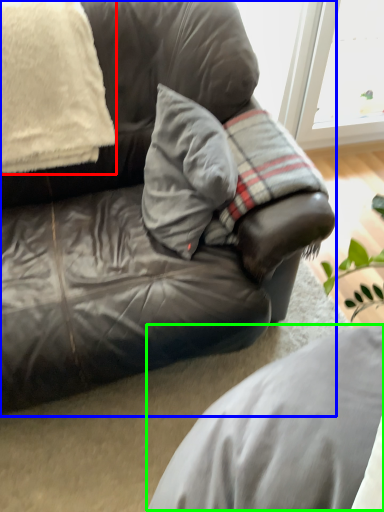
Question: Based on their relative distances, which object is farther from pillow (highlighted by a red box)? Choose from studio couch (highlighted by a blue box) and gray (highlighted by a green box).

Choices:
 (A) studio couch
 (B) gray

Answer: (B)